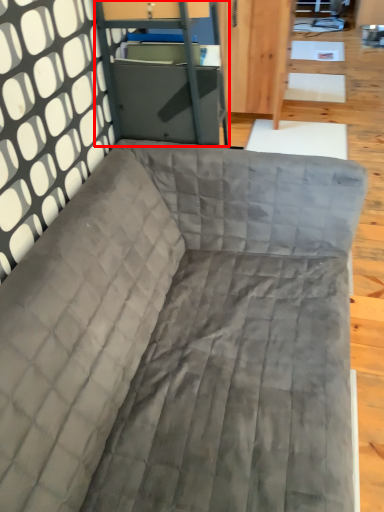
Question: In this image, where is file cabinet (annotated by the red box) located relative to studio couch?

Choices:
 (A) left
 (B) right

Answer: (A)